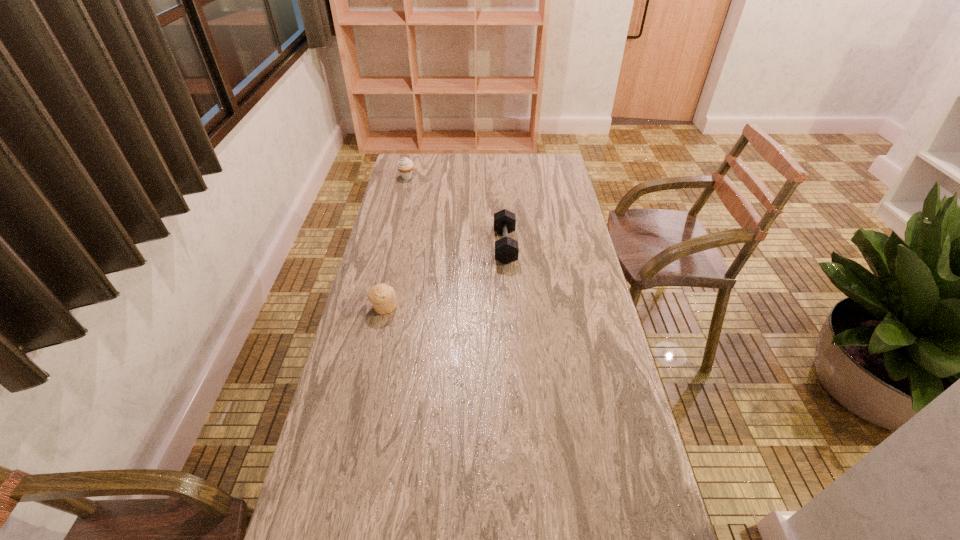
At what (x,y) coordinates should I click in order to perform the action: click on the taller muffin. Please return your answer as a coordinate pair (x, y). Looking at the image, I should click on (405, 166).

Locate an element on the screen. This screenshot has height=540, width=960. the farther muffin is located at coordinates (405, 166).

Identify the location of dumbbell. Image resolution: width=960 pixels, height=540 pixels. (506, 249).

You are a GUI agent. You are given a task and a screenshot of the screen. Output one action in this format:
    pyautogui.click(x=<x>, y=<y>)
    Task: Click on the second nearest object
    Image resolution: width=960 pixels, height=540 pixels.
    Given the screenshot: What is the action you would take?
    pyautogui.click(x=506, y=249)

The width and height of the screenshot is (960, 540). Find the location of `the nearest object`. the nearest object is located at coordinates (383, 297).

This screenshot has height=540, width=960. I want to click on the shorter muffin, so click(x=383, y=297).

Where is `vacant space situated on the front of the taller muffin`? This screenshot has width=960, height=540. vacant space situated on the front of the taller muffin is located at coordinates (396, 218).

Locate an element on the screen. free location located 0.370m on the left of the rightmost object is located at coordinates (396, 246).

Where is `free space located 0.060m on the back of the nearer muffin`? The height and width of the screenshot is (540, 960). free space located 0.060m on the back of the nearer muffin is located at coordinates (389, 285).

Where is `object located in the far edge section of the desktop`? object located in the far edge section of the desktop is located at coordinates click(405, 166).